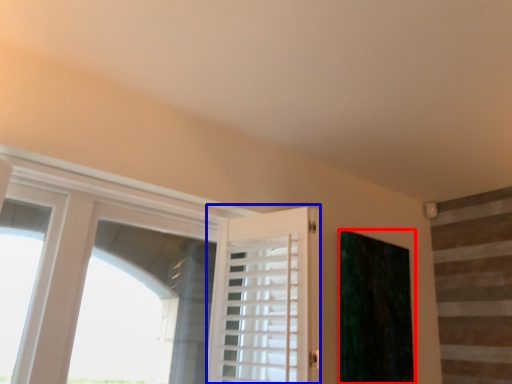
Question: Which point is closer to the camera, curtain (highlighted by a red box) or barn door (highlighted by a blue box)?

Choices:
 (A) curtain
 (B) barn door

Answer: (B)